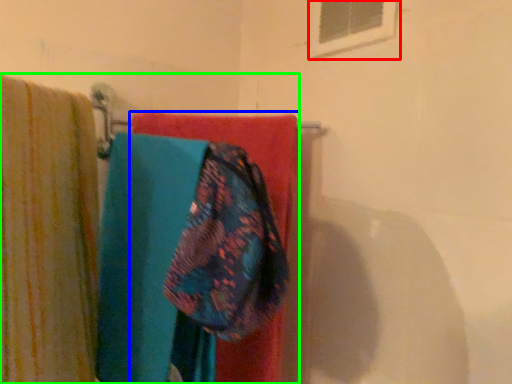
Question: Which object is the farthest from window (highlighted by a red box)? Choose among these: towel (highlighted by a blue box) or laundry (highlighted by a green box).

Choices:
 (A) towel
 (B) laundry

Answer: (B)